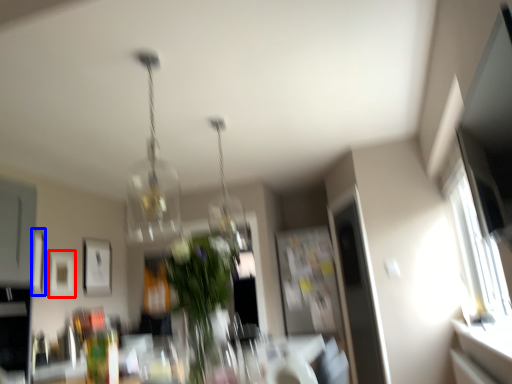
Question: Among these objects, which one is nearest to the camera, picture frame (highlighted by a red box) or picture frame (highlighted by a blue box)?

Choices:
 (A) picture frame
 (B) picture frame

Answer: (B)